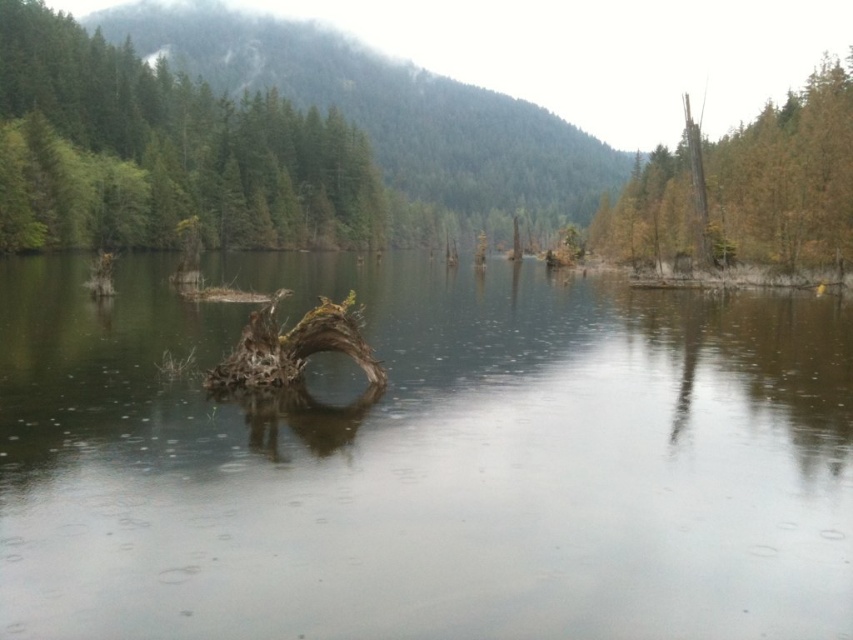
Between transparent water at center and brown wood tree stump at upper right, which one has more height?

With more height is brown wood tree stump at upper right.

Is transparent water at center smaller than brown wood tree stump at upper right?

Yes, transparent water at center is smaller than brown wood tree stump at upper right.

This screenshot has width=853, height=640. Describe the element at coordinates (425, 461) in the screenshot. I see `transparent water at center` at that location.

This screenshot has height=640, width=853. Find the location of `transparent water at center`. transparent water at center is located at coordinates (425, 461).

Who is shorter, brown wood tree stump at upper right or brown rough tree trunk at right?

Standing shorter between the two is brown wood tree stump at upper right.

Who is lower down, brown wood tree stump at upper right or brown rough tree trunk at right?

brown wood tree stump at upper right

Identify the location of brown wood tree stump at upper right. This screenshot has width=853, height=640. (746, 188).

Is transparent water at center positioned behind brown rough tree trunk at right?

No, transparent water at center is in front of brown rough tree trunk at right.

Find the location of a particular element. The width and height of the screenshot is (853, 640). transparent water at center is located at coordinates (425, 461).